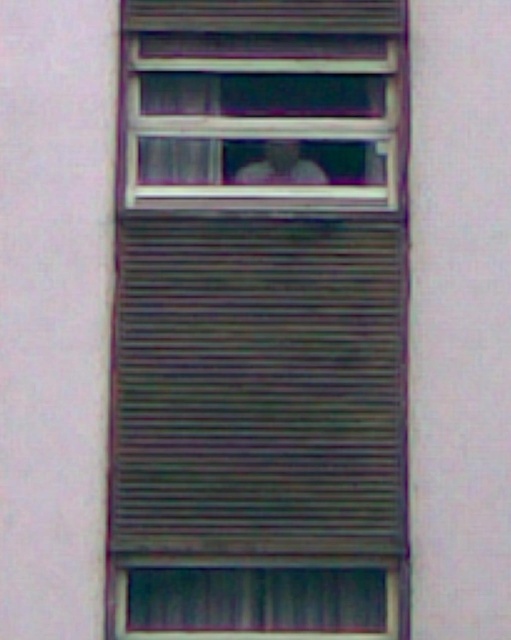
Between point (159, 444) and point (292, 168), which one is positioned behind?

The point (292, 168) is more distant.

Does metallic gray shutter at center appear under light skin tone human face at center?

Correct, metallic gray shutter at center is located below light skin tone human face at center.

Which is in front, point (270, 257) or point (304, 157)?

Positioned in front is point (270, 257).

Locate an element on the screen. Image resolution: width=511 pixels, height=640 pixels. metallic gray shutter at center is located at coordinates (259, 385).